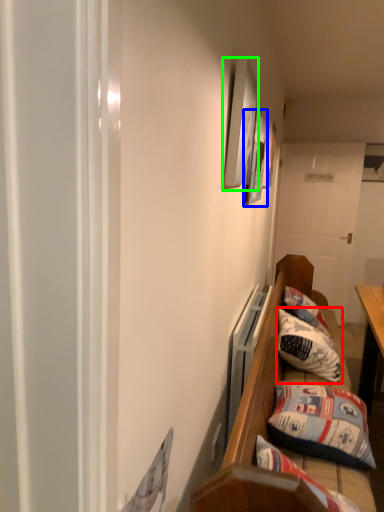
Question: Considering the real-world distances, which object is farthest from pillow (highlighted by a red box)? picture frame (highlighted by a blue box) or picture frame (highlighted by a green box)?

Choices:
 (A) picture frame
 (B) picture frame

Answer: (B)